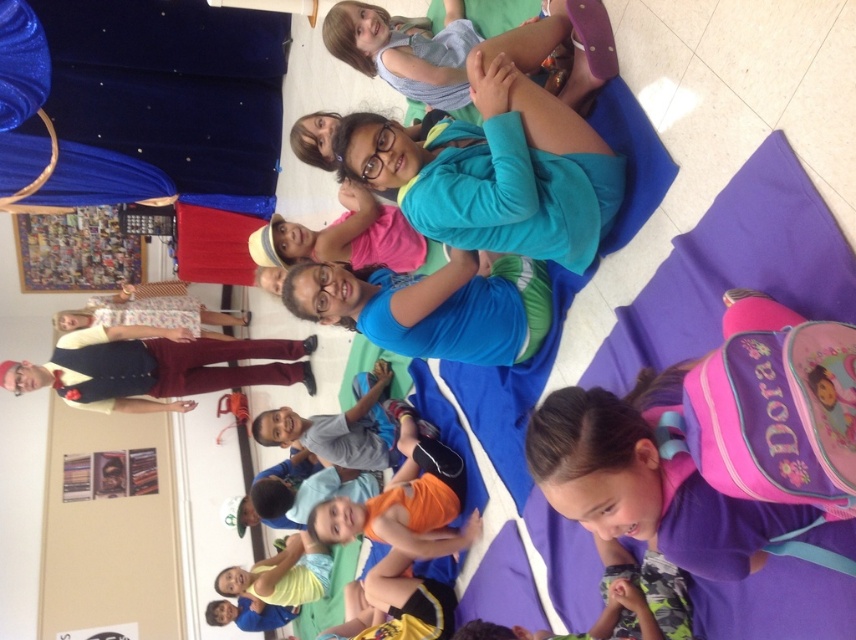
Is purple fabric backpack at lower right thinner than blue denim dress at upper center?

In fact, purple fabric backpack at lower right might be wider than blue denim dress at upper center.

Measure the distance between point (657,529) and camera.

Point (657,529) is 1.95 meters away from camera.

The height and width of the screenshot is (640, 856). I want to click on purple fabric backpack at lower right, so click(663, 490).

Does purple fabric backpack at lower right have a larger size compared to blue fabric at center?

No, purple fabric backpack at lower right is not bigger than blue fabric at center.

Is point (592, 426) positioned behind point (519, 301)?

No, (592, 426) is closer to viewer.

In order to click on purple fabric backpack at lower right in this screenshot , I will do `click(663, 490)`.

Between purple fabric backpack at lower right and maroon velvet pants at left, which one appears on the right side from the viewer's perspective?

From the viewer's perspective, purple fabric backpack at lower right appears more on the right side.

Is point (813, 515) in front of point (116, 364)?

Yes, it is in front of point (116, 364).

Who is more distant from viewer, (633, 451) or (4, 364)?

The point (4, 364) is more distant.

The height and width of the screenshot is (640, 856). What are the coordinates of `purple fabric backpack at lower right` in the screenshot? It's located at (663, 490).